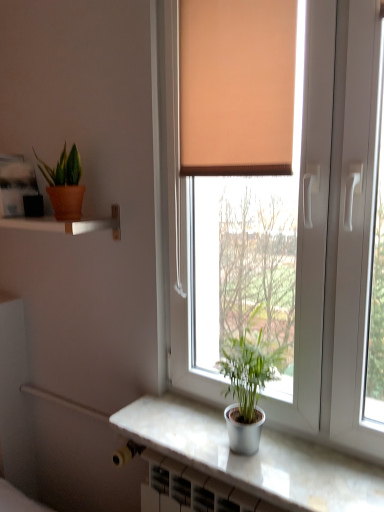
This screenshot has height=512, width=384. What do you see at coordinates (237, 86) in the screenshot? I see `orange fabric curtain at upper center` at bounding box center [237, 86].

What do you see at coordinates (67, 224) in the screenshot?
I see `matte white shelf at upper left` at bounding box center [67, 224].

Image resolution: width=384 pixels, height=512 pixels. Identify the location of matte white shelf at upper left. [x=67, y=224].

What do you see at coordinates (253, 457) in the screenshot? I see `white marble counter top at lower center` at bounding box center [253, 457].

Where is `silver metallic pot at window, which is the second houseplant in top-to-bottom order`? This screenshot has width=384, height=512. silver metallic pot at window, which is the second houseplant in top-to-bottom order is located at coordinates (247, 389).

This screenshot has width=384, height=512. What do you see at coordinates (335, 226) in the screenshot?
I see `white plastic window at center` at bounding box center [335, 226].

The width and height of the screenshot is (384, 512). Identify the location of orange fabric curtain at upper center. (237, 86).

In terms of height, does white plastic window at center look taller or shorter compared to matte white shelf at upper left?

white plastic window at center is taller than matte white shelf at upper left.

Is white plastic window at center beside matte white shelf at upper left?

white plastic window at center and matte white shelf at upper left are not in contact.

In the scene shown: Does white plastic window at center turn towards matte white shelf at upper left?

No, white plastic window at center is not aimed at matte white shelf at upper left.

From the image's perspective, is white plastic window at center located above or below matte white shelf at upper left?

Clearly, from the image's perspective, white plastic window at center is below matte white shelf at upper left.

Considering the sizes of objects white marble counter top at lower center and silver metallic pot at window, which is counted as the 1th houseplant, starting from the front, in the image provided, who is wider, white marble counter top at lower center or silver metallic pot at window, which is counted as the 1th houseplant, starting from the front,?

white marble counter top at lower center is wider.

Does white marble counter top at lower center have a smaller size compared to silver metallic pot at window, the 2th houseplant when ordered from back to front?

Yes.

How many degrees apart are the facing directions of white marble counter top at lower center and silver metallic pot at window, which is counted as the 2th houseplant, starting from the left?

0.136 degrees.

Is orange fabric curtain at upper center facing towards matte white shelf at upper left?

No, orange fabric curtain at upper center is not turned towards matte white shelf at upper left.

Can you confirm if orange fabric curtain at upper center is bigger than matte white shelf at upper left?

Yes, orange fabric curtain at upper center is bigger than matte white shelf at upper left.

Which is in front, point (223, 136) or point (86, 219)?

The point (223, 136) is closer.

How different are the orientations of orange fabric curtain at upper center and matte white shelf at upper left in degrees?

The angle between the facing direction of orange fabric curtain at upper center and the facing direction of matte white shelf at upper left is 1.3 degrees.

How much distance is there between white plastic window at center and orange fabric curtain at upper center?

A distance of 7.12 inches exists between white plastic window at center and orange fabric curtain at upper center.

Considering the relative sizes of white plastic window at center and orange fabric curtain at upper center in the image provided, is white plastic window at center thinner than orange fabric curtain at upper center?

In fact, white plastic window at center might be wider than orange fabric curtain at upper center.

Who is smaller, white plastic window at center or orange fabric curtain at upper center?

orange fabric curtain at upper center.

Is point (354, 28) positioned before point (286, 49)?

Yes, it is in front of point (286, 49).

From the image's perspective, which object appears higher, matte terracotta pot at upper left, the 2th houseplant from the front, or white plastic window at center?

matte terracotta pot at upper left, the 2th houseplant from the front, from the image's perspective.

Is matte terracotta pot at upper left, which is the first houseplant from back to front, smaller than white plastic window at center?

Indeed, matte terracotta pot at upper left, which is the first houseplant from back to front, has a smaller size compared to white plastic window at center.

From a real-world perspective, between matte terracotta pot at upper left, the 2th houseplant when ordered from bottom to top, and white plastic window at center, who is vertically lower?

white plastic window at center is physically lower.

Can you confirm if matte terracotta pot at upper left, which is the first houseplant from back to front, is positioned to the left of white plastic window at center?

Correct, you'll find matte terracotta pot at upper left, which is the first houseplant from back to front, to the left of white plastic window at center.

Is white plastic window at center far from silver metallic pot at window, which is counted as the first houseplant, starting from the bottom?

No, white plastic window at center is not far from silver metallic pot at window, which is counted as the first houseplant, starting from the bottom.

Would you say white plastic window at center is outside silver metallic pot at window, which is counted as the 1th houseplant, starting from the right?

Absolutely, white plastic window at center is external to silver metallic pot at window, which is counted as the 1th houseplant, starting from the right.

Could you tell me if white plastic window at center is turned towards silver metallic pot at window, which is counted as the first houseplant, starting from the bottom?

Yes, white plastic window at center is facing silver metallic pot at window, which is counted as the first houseplant, starting from the bottom.

From the picture: From a real-world perspective, is white plastic window at center below silver metallic pot at window, which is the second houseplant in top-to-bottom order?

Actually, white plastic window at center is physically above silver metallic pot at window, which is the second houseplant in top-to-bottom order, in the real world.

Between matte white shelf at upper left and orange fabric curtain at upper center, which one has less height?

Standing shorter between the two is matte white shelf at upper left.

Does matte white shelf at upper left have a lesser width compared to orange fabric curtain at upper center?

No.

Is matte white shelf at upper left far away from orange fabric curtain at upper center?

Actually, matte white shelf at upper left and orange fabric curtain at upper center are a little close together.

From the image's perspective, which is above, matte white shelf at upper left or orange fabric curtain at upper center?

orange fabric curtain at upper center appears higher in the image.

Find the location of `shelf on the left of white plastic window at center`. shelf on the left of white plastic window at center is located at coordinates (67, 224).

Locate an element on the screen. counter top in front of the silver metallic pot at window, which is counted as the 1th houseplant, starting from the front is located at coordinates (253, 457).

Which object lies further to the anchor point white plastic window at center, silver metallic pot at window, which is counted as the 1th houseplant, starting from the front, or orange fabric curtain at upper center?

silver metallic pot at window, which is counted as the 1th houseplant, starting from the front.

From the picture: From the image, which object appears to be farther from matte terracotta pot at upper left, which is the first houseplant from back to front, white plastic window at center or silver metallic pot at window, which is counted as the first houseplant, starting from the bottom?

The object further to matte terracotta pot at upper left, which is the first houseplant from back to front, is silver metallic pot at window, which is counted as the first houseplant, starting from the bottom.

Considering their positions, is orange fabric curtain at upper center positioned further to white marble counter top at lower center than matte terracotta pot at upper left, which is the first houseplant from back to front?

orange fabric curtain at upper center is positioned further to the anchor white marble counter top at lower center.

Estimate the real-world distances between objects in this image. Which object is further from orange fabric curtain at upper center, matte white shelf at upper left or silver metallic pot at window, which is the second houseplant in top-to-bottom order?

Among the two, silver metallic pot at window, which is the second houseplant in top-to-bottom order, is located further to orange fabric curtain at upper center.

In the scene shown: When comparing their distances from matte white shelf at upper left, does silver metallic pot at window, the 2th houseplant when ordered from back to front, or matte terracotta pot at upper left, the 2th houseplant from the front, seem closer?

matte terracotta pot at upper left, the 2th houseplant from the front, lies closer to matte white shelf at upper left than the other object.

Which object lies nearer to the anchor point matte terracotta pot at upper left, the 2th houseplant when ordered from bottom to top, white marble counter top at lower center or white plastic window at center?

Based on the image, white plastic window at center appears to be nearer to matte terracotta pot at upper left, the 2th houseplant when ordered from bottom to top.

Estimate the real-world distances between objects in this image. Which object is closer to white marble counter top at lower center, silver metallic pot at window, which is counted as the 1th houseplant, starting from the right, or white plastic window at center?

silver metallic pot at window, which is counted as the 1th houseplant, starting from the right, is closer to white marble counter top at lower center.

From the picture: Looking at the image, which one is located closer to orange fabric curtain at upper center, white marble counter top at lower center or white plastic window at center?

white plastic window at center.

The width and height of the screenshot is (384, 512). I want to click on curtain between matte terracotta pot at upper left, which ranks as the first houseplant in left-to-right order, and white plastic window at center, in the horizontal direction, so click(237, 86).

Locate an element on the screen. window that lies between orange fabric curtain at upper center and silver metallic pot at window, which is the second houseplant in top-to-bottom order, from top to bottom is located at coordinates (335, 226).

This screenshot has width=384, height=512. What are the coordinates of `window that lies between orange fabric curtain at upper center and white marble counter top at lower center from top to bottom` in the screenshot? It's located at (335, 226).

Find the location of a particular element. counter top between matte white shelf at upper left and white plastic window at center is located at coordinates (253, 457).